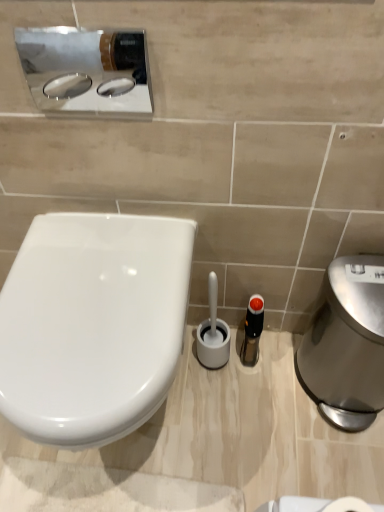
Where is `blank space situated above white glossy toilet at left (from a real-world perspective)`? blank space situated above white glossy toilet at left (from a real-world perspective) is located at coordinates (89, 292).